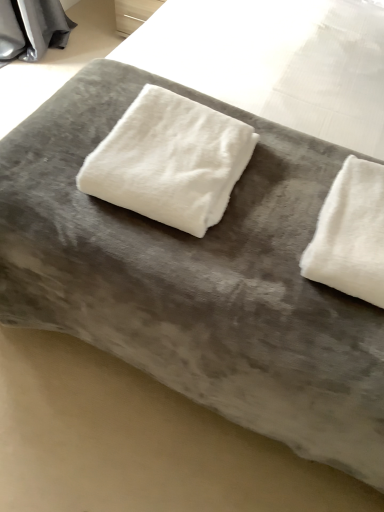
Question: Is white fluffy towel at center, marked as the 2th towel in a right-to-left arrangement, inside the boundaries of white fluffy towel at right, the second towel from the left, or outside?

Choices:
 (A) outside
 (B) inside

Answer: (A)

Question: Does point (155, 153) appear closer or farther from the camera than point (357, 242)?

Choices:
 (A) farther
 (B) closer

Answer: (A)

Question: From the image's perspective, is white fluffy towel at center, placed as the first towel when sorted from left to right, positioned above or below white fluffy towel at right, the second towel from the left?

Choices:
 (A) below
 (B) above

Answer: (B)

Question: Considering the positions of white fluffy towel at right, the second towel from the left, and white fluffy towel at center, placed as the first towel when sorted from left to right, in the image, is white fluffy towel at right, the second towel from the left, bigger or smaller than white fluffy towel at center, placed as the first towel when sorted from left to right,?

Choices:
 (A) big
 (B) small

Answer: (B)

Question: Considering the positions of white fluffy towel at right, the second towel from the left, and white fluffy towel at center, placed as the first towel when sorted from left to right, in the image, is white fluffy towel at right, the second towel from the left, taller or shorter than white fluffy towel at center, placed as the first towel when sorted from left to right,?

Choices:
 (A) short
 (B) tall

Answer: (A)

Question: Is point (375, 189) closer or farther from the camera than point (198, 163)?

Choices:
 (A) closer
 (B) farther

Answer: (B)

Question: From the image's perspective, relative to white fluffy towel at center, marked as the 2th towel in a right-to-left arrangement, is white fluffy towel at right, the first towel viewed from the right, above or below?

Choices:
 (A) below
 (B) above

Answer: (A)